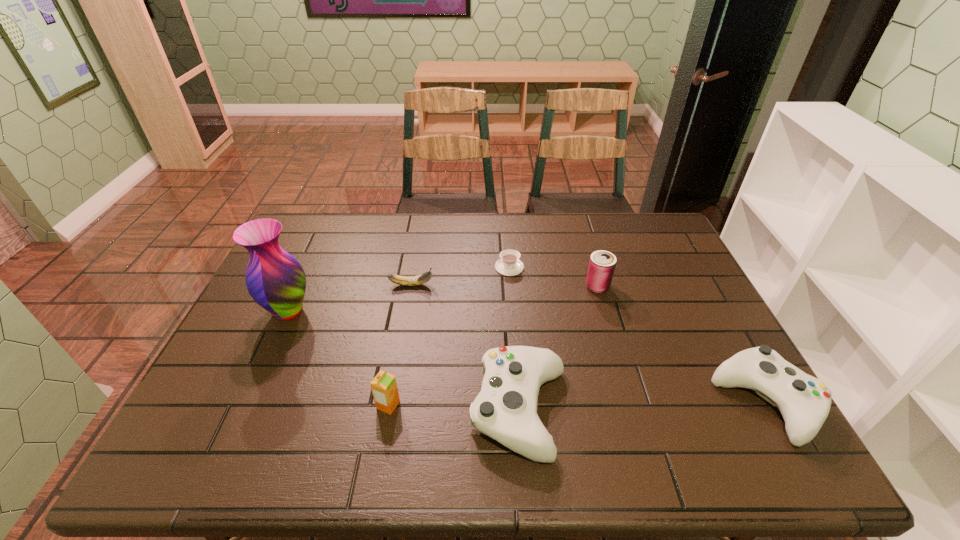
Where is `free space located 0.110m on the back of the left control`? This screenshot has height=540, width=960. free space located 0.110m on the back of the left control is located at coordinates (513, 331).

Where is `vacant space positioned on the left of the shorter control`? This screenshot has height=540, width=960. vacant space positioned on the left of the shorter control is located at coordinates (662, 402).

I want to click on vacant region located on the handle side of the teacup, so click(x=476, y=267).

The width and height of the screenshot is (960, 540). I want to click on free space located 0.210m on the handle side of the teacup, so click(429, 267).

Where is `vacant space located on the handle side of the teacup`? This screenshot has width=960, height=540. vacant space located on the handle side of the teacup is located at coordinates (473, 267).

Where is `vacant point located 0.300m on the left of the sixth object from left to right`? Image resolution: width=960 pixels, height=540 pixels. vacant point located 0.300m on the left of the sixth object from left to right is located at coordinates (487, 286).

I want to click on free space located 0.310m at the stem of the banana, so click(x=536, y=285).

Identify the location of free location located on the left of the orange juice. (296, 405).

Where is `vacant region located 0.140m on the right of the leftmost object`? The height and width of the screenshot is (540, 960). vacant region located 0.140m on the right of the leftmost object is located at coordinates (363, 311).

The height and width of the screenshot is (540, 960). What are the coordinates of `orange juice at the near edge` in the screenshot? It's located at (384, 388).